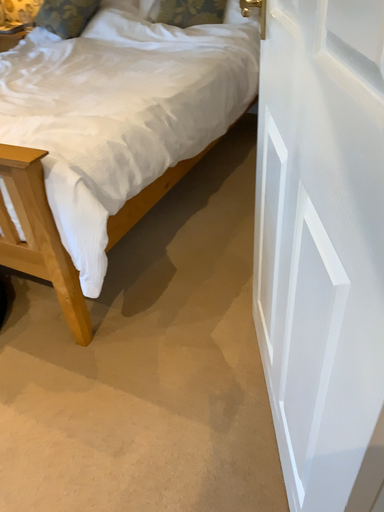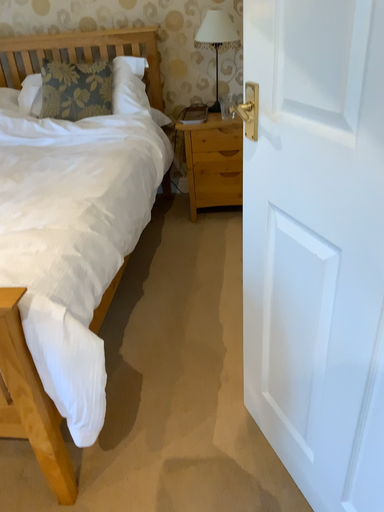
Question: Which way did the camera rotate in the video?

Choices:
 (A) rotated right
 (B) rotated left

Answer: (A)